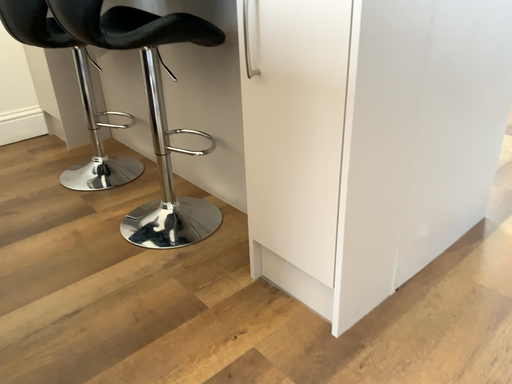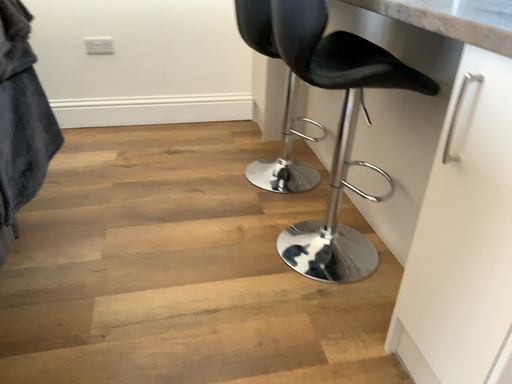
Question: How did the camera likely rotate when shooting the video?

Choices:
 (A) rotated left
 (B) rotated right

Answer: (A)